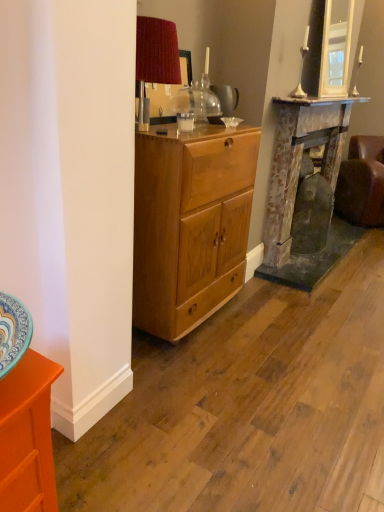
Question: Is rusty metal fireplace at right inside the boundaries of silver metallic candle holder at upper right, or outside?

Choices:
 (A) outside
 (B) inside

Answer: (A)

Question: From the image's perspective, is rusty metal fireplace at right located above or below silver metallic candle holder at upper right?

Choices:
 (A) above
 (B) below

Answer: (B)

Question: Which object is positioned farthest from the silver metallic candle holder at upper right?

Choices:
 (A) light brown wood cabinet at center
 (B) clear glass coffee cup at center
 (C) rusty metal fireplace at right
 (D) translucent glass teapot at center
 (E) brown leather couch at right

Answer: (B)

Question: Which object is positioned farthest from the brown leather couch at right?

Choices:
 (A) translucent glass teapot at center
 (B) light brown wood cabinet at center
 (C) rusty metal fireplace at right
 (D) orange glossy cabinet at lower left
 (E) silver metallic candle holder at upper right

Answer: (D)